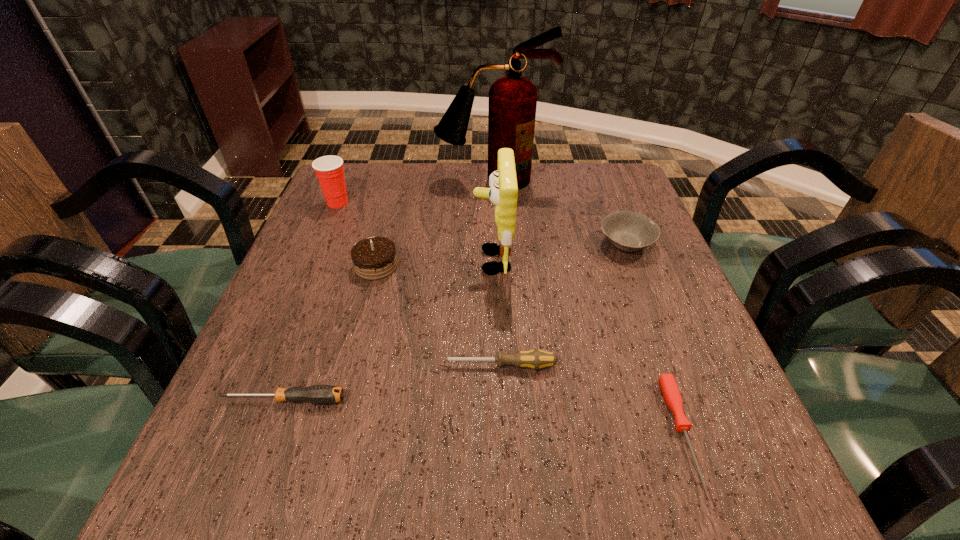
This screenshot has height=540, width=960. Identify the location of the rightmost screwdriver. (671, 393).

Locate an element on the screen. The width and height of the screenshot is (960, 540). the shortest screwdriver is located at coordinates (671, 393).

The width and height of the screenshot is (960, 540). Find the location of `free space located 0.190m at the nozzle of the tallest object`. free space located 0.190m at the nozzle of the tallest object is located at coordinates (495, 233).

This screenshot has height=540, width=960. Find the location of `vacant space located on the face of the sponge`. vacant space located on the face of the sponge is located at coordinates (372, 261).

The image size is (960, 540). Identify the location of free spot located 0.220m on the face of the sponge. (377, 261).

At what (x,y) coordinates should I click in order to perform the action: click on vacant space situated on the face of the sponge. Please return your answer as a coordinate pair (x, y). Image resolution: width=960 pixels, height=540 pixels. Looking at the image, I should click on (302, 261).

At what (x,y) coordinates should I click in order to perform the action: click on free space located 0.160m on the back of the seventh nearest object. Please return your answer as a coordinate pair (x, y). Image resolution: width=960 pixels, height=540 pixels. Looking at the image, I should click on (353, 166).

The height and width of the screenshot is (540, 960). I want to click on vacant space situated 0.080m on the right of the fourth tallest object, so click(x=433, y=266).

Where is `blank space located 0.270m on the back of the bowl`? The height and width of the screenshot is (540, 960). blank space located 0.270m on the back of the bowl is located at coordinates (598, 172).

You are a GUI agent. You are given a task and a screenshot of the screen. Output one action in this format:
    pyautogui.click(x=<x>, y=<y>)
    Task: Click on the vacant space located 0.090m at the tip of the second screwdriver from left to right
    Image resolution: width=960 pixels, height=540 pixels.
    Given the screenshot: What is the action you would take?
    pyautogui.click(x=392, y=366)